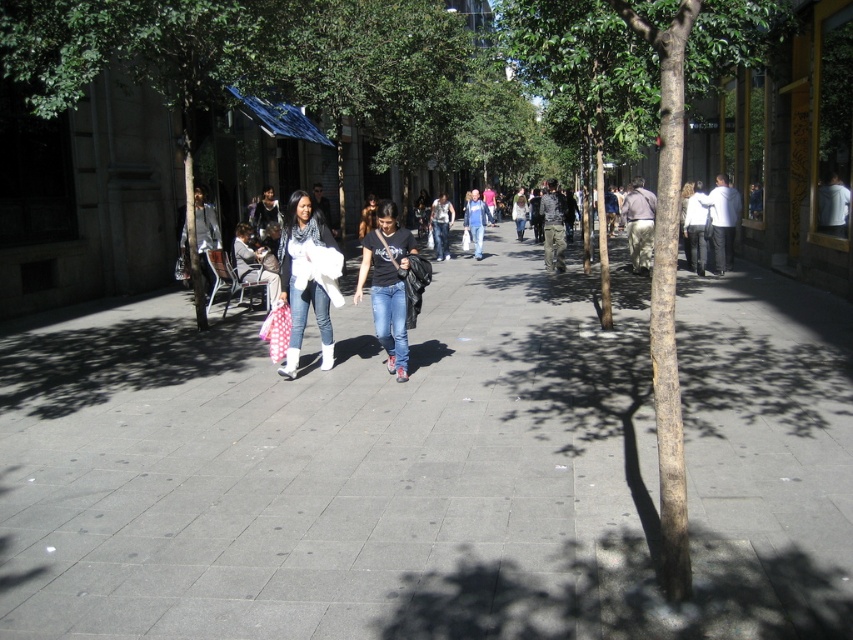
Does black matte t-shirt at center have a larger size compared to blue jeans at center?

Incorrect, black matte t-shirt at center is not larger than blue jeans at center.

Which of these two, black matte t-shirt at center or blue jeans at center, stands shorter?

black matte t-shirt at center

Does point (402, 307) come closer to viewer compared to point (477, 227)?

That is True.

At what (x,y) coordinates should I click in order to perform the action: click on black matte t-shirt at center. Please return your answer as a coordinate pair (x, y). Looking at the image, I should click on (387, 284).

Is denim jeans at center further to camera compared to blue jeans at center?

No.

Can you confirm if denim jeans at center is positioned above blue jeans at center?

Yes, denim jeans at center is above blue jeans at center.

You are a GUI agent. You are given a task and a screenshot of the screen. Output one action in this format:
    pyautogui.click(x=<x>, y=<y>)
    Task: Click on the denim jeans at center
    The image size is (853, 640).
    Given the screenshot: What is the action you would take?
    pyautogui.click(x=440, y=225)

From the picture: Can you confirm if black matte t-shirt at center is wider than denim jeans at center?

No.

From the picture: Does black matte t-shirt at center have a lesser width compared to denim jeans at center?

Yes.

Is point (405, 259) positioned behind point (440, 202)?

No, (405, 259) is closer to viewer.

At what (x,y) coordinates should I click in order to perform the action: click on black matte t-shirt at center. Please return your answer as a coordinate pair (x, y). The height and width of the screenshot is (640, 853). Looking at the image, I should click on (387, 284).